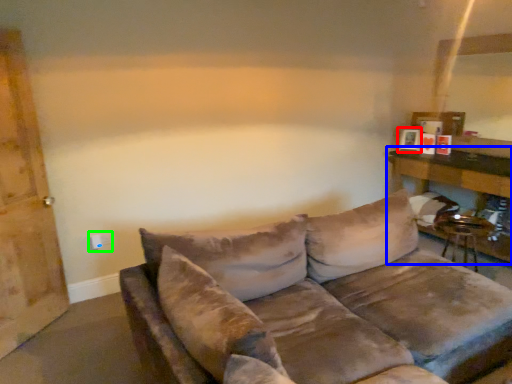
Question: Based on their relative distances, which object is farther from picture frame (highlighted by a red box)? Choose from table (highlighted by a blue box) and electric outlet (highlighted by a green box).

Choices:
 (A) table
 (B) electric outlet

Answer: (B)